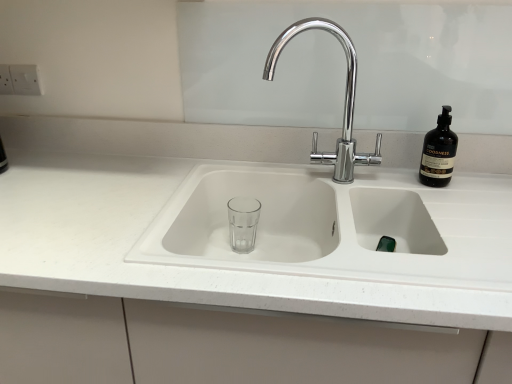
Where is `free space in front of dark brown glass bottle at upper right`? free space in front of dark brown glass bottle at upper right is located at coordinates (462, 203).